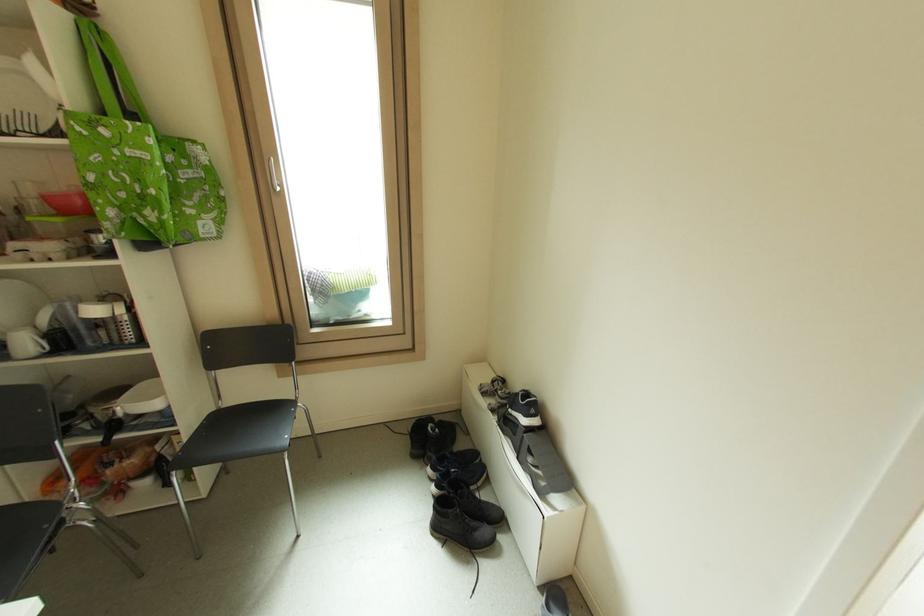
The image size is (924, 616). What do you see at coordinates (103, 73) in the screenshot? I see `the green bag handle` at bounding box center [103, 73].